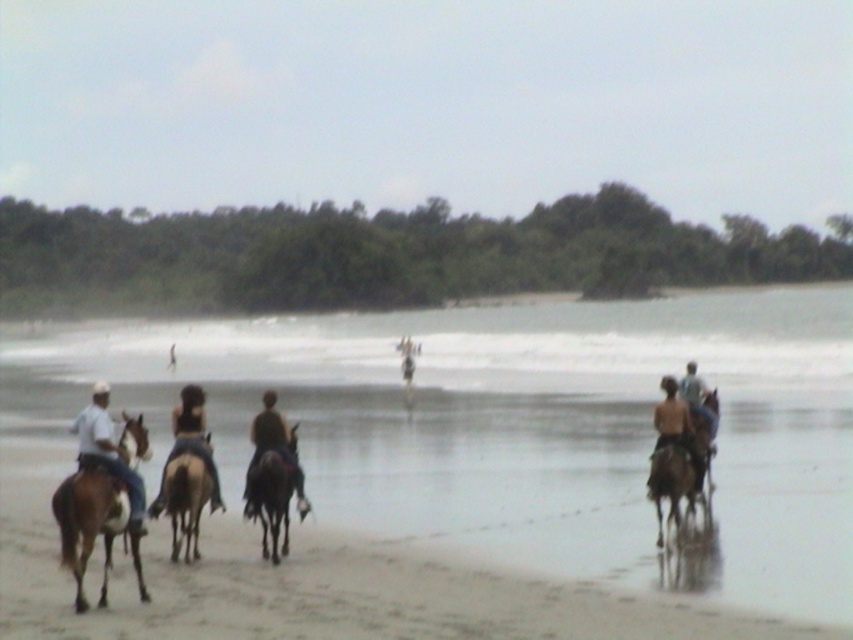
You are a photographer trying to capture the dark brown horse at center in your shot. The camera you are using has a focal length of 50mm. If the horse is located at coordinates point 0.703, 0.321, what is the best way to frame the shot to ensure the horse is centered in the photo?

To center the dark brown horse at center in the photo, position the camera so that the crosshairs align with the coordinates point (273,449). This will ensure the horse is at the focal point of the image.

Looking at this image, you are a photographer trying to capture a wide shot of the dark brown horse at center and the shiny brown horse at right. Based on their sizes in the image, which horse would appear smaller in the photo?

The dark brown horse at center appears smaller in the photo because it has a lesser width compared to the shiny brown horse at right.

You are standing at the camera position and want to take a photo of the dark brown horse at center. Considering the camera has a maximum focus range of 15 meters, will the horse be in focus?

The dark brown horse at center is 14.84 meters from camera, which is within the camera maximum focus range of 15 meters. Therefore, the horse will be in focus.